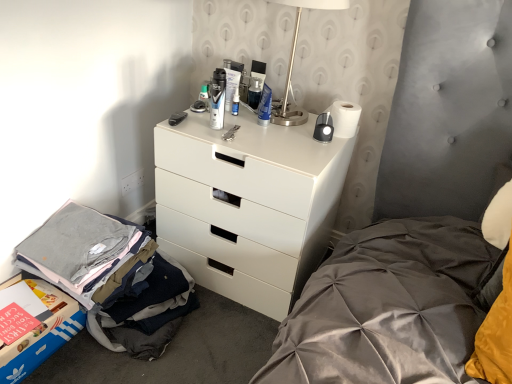
Where is `free space in front of blue plastic tube at center, positioned as the 5th toiletry in left-to-right order`? The height and width of the screenshot is (384, 512). free space in front of blue plastic tube at center, positioned as the 5th toiletry in left-to-right order is located at coordinates (260, 141).